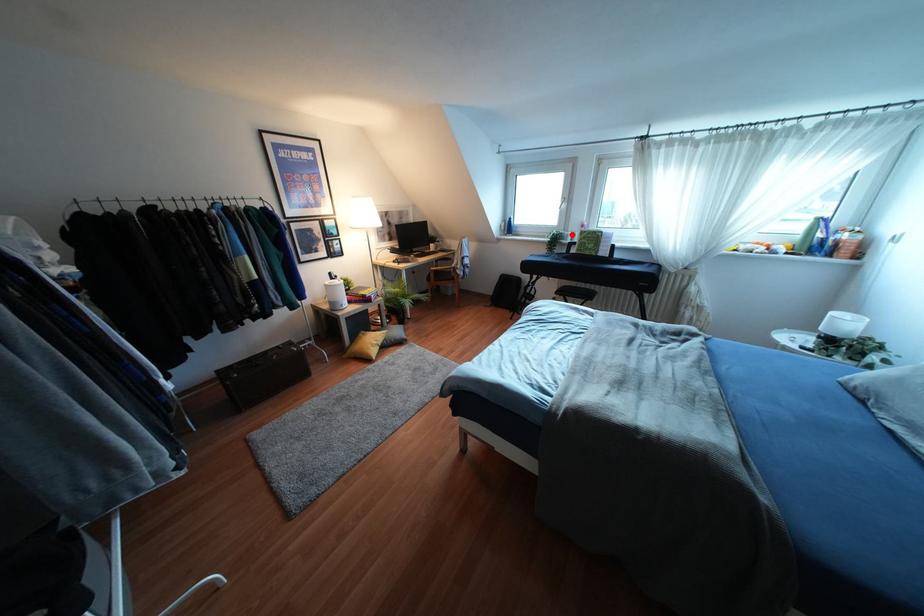
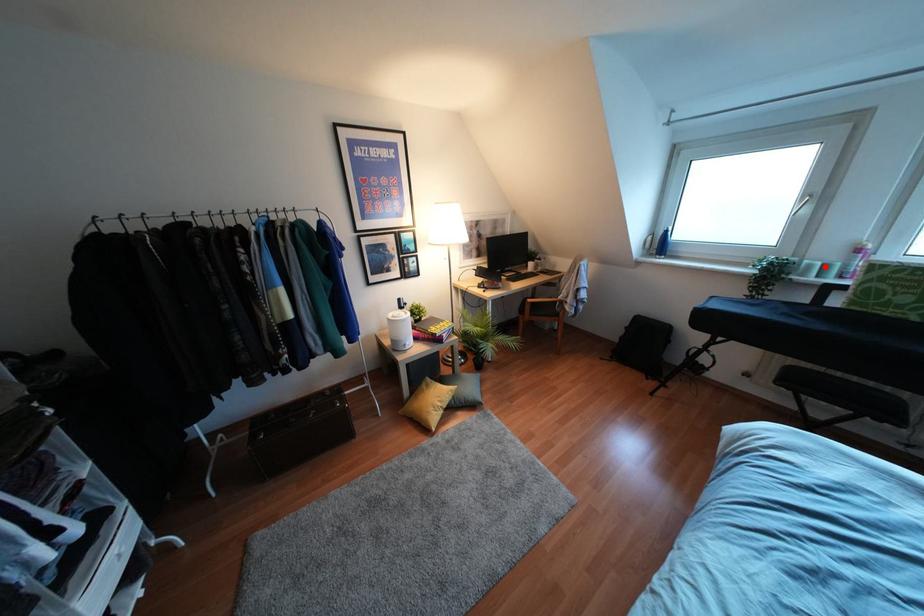
I am providing you with two images of the same scene from different viewpoints. A red point is marked on the first image and another point is marked on the second image. Do the highlighted points in image1 and image2 indicate the same real-world spot?

Yes